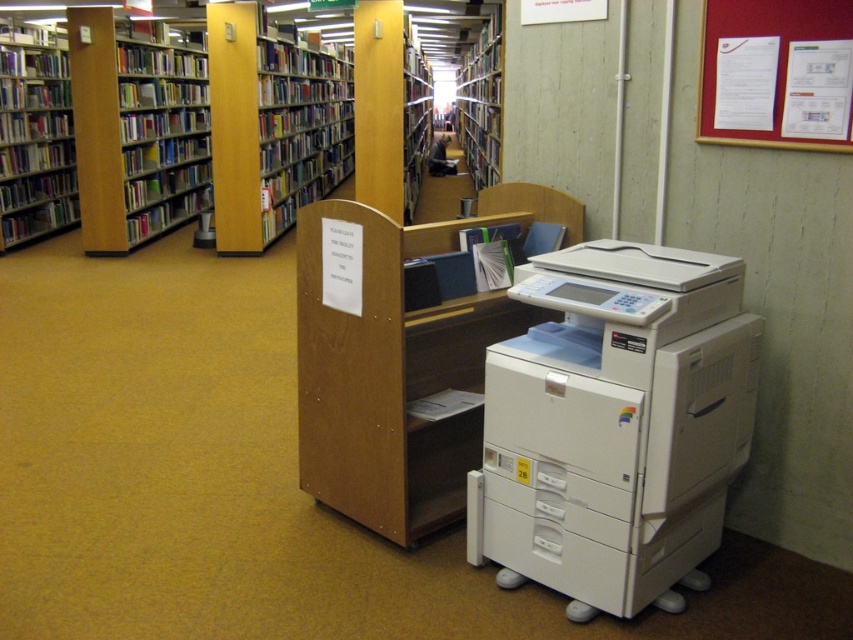
Question: Based on their relative distances, which object is farther from the wooden bookcase at center?

Choices:
 (A) wooden bookshelf at left
 (B) wooden bookcase at left
 (C) white paper at upper right
 (D) white plastic printer at lower right

Answer: (D)

Question: Based on their relative distances, which object is farther from the wooden bookcase at left?

Choices:
 (A) white paper at upper right
 (B) wooden bookcase at center
 (C) white plastic printer at lower right
 (D) wooden bookshelf at left

Answer: (A)

Question: Considering the relative positions of white paper at upper right and wooden bookcase at center in the image provided, where is white paper at upper right located with respect to wooden bookcase at center?

Choices:
 (A) below
 (B) above

Answer: (A)

Question: Which of these objects is positioned farthest from the white plastic printer at lower right?

Choices:
 (A) wooden bookshelf at left
 (B) white paper at upper right
 (C) wooden bookcase at center

Answer: (A)

Question: Can you confirm if white plastic printer at lower right is bigger than white paper at upper right?

Choices:
 (A) no
 (B) yes

Answer: (B)

Question: In this image, where is white plastic printer at lower right located relative to wooden bookshelf at left?

Choices:
 (A) left
 (B) right

Answer: (B)